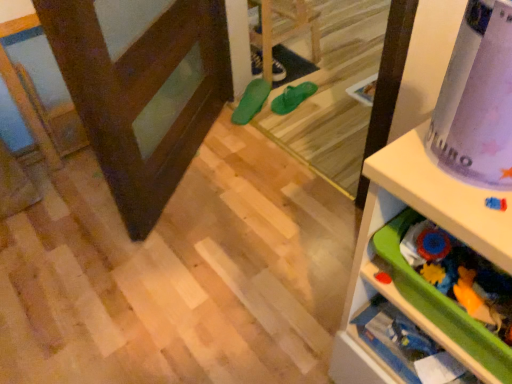
At what (x,y) coordinates should I click in order to perform the action: click on vacant region under dark brown wood screen door at left (from a real-world perspective). Please return your answer as a coordinate pair (x, y). The height and width of the screenshot is (384, 512). Looking at the image, I should click on (188, 169).